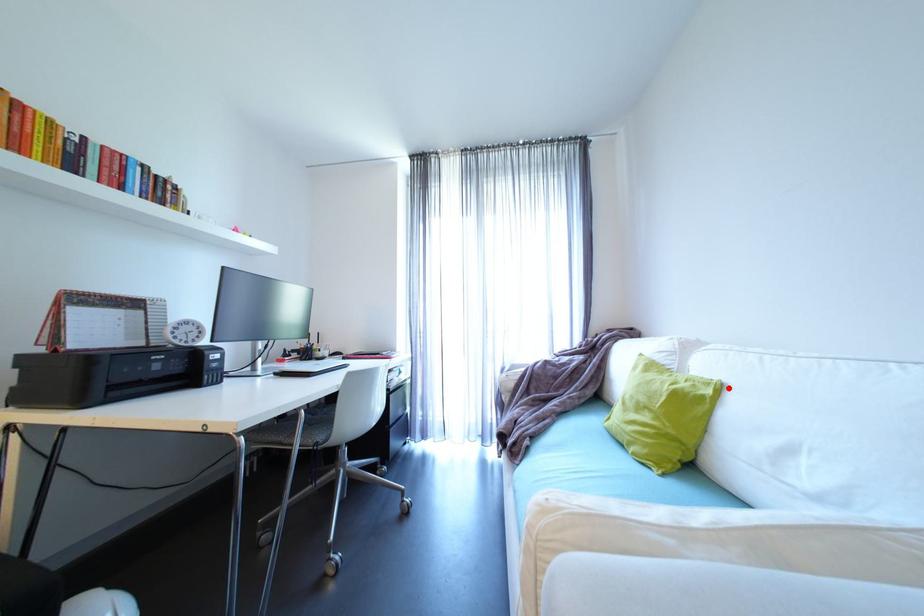
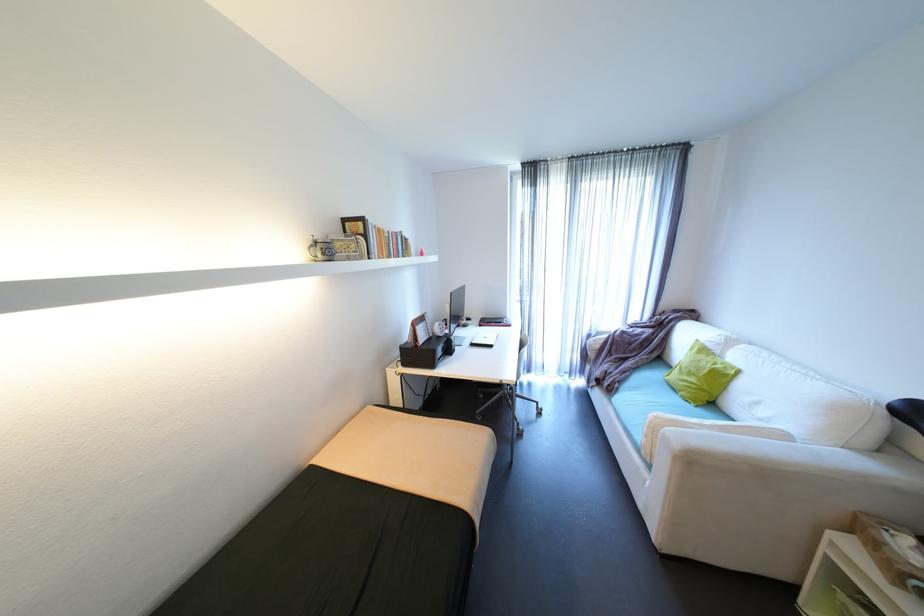
The point at the highlighted location is marked in the first image. Where is the corresponding point in the second image?

(747, 371)